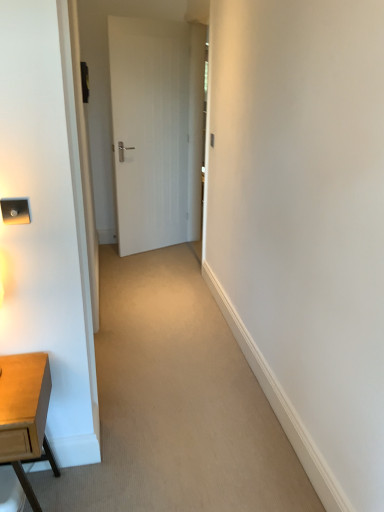
Locate an element on the screen. free spot above light brown wooden desk at lower left (from a real-world perspective) is located at coordinates (19, 389).